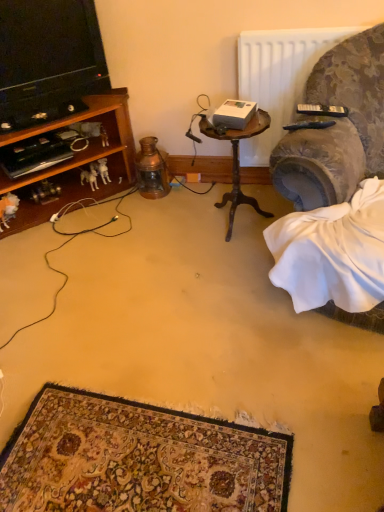
Find the location of `free space below black cable at left (from a real-world perspective)`. free space below black cable at left (from a real-world perspective) is located at coordinates (61, 255).